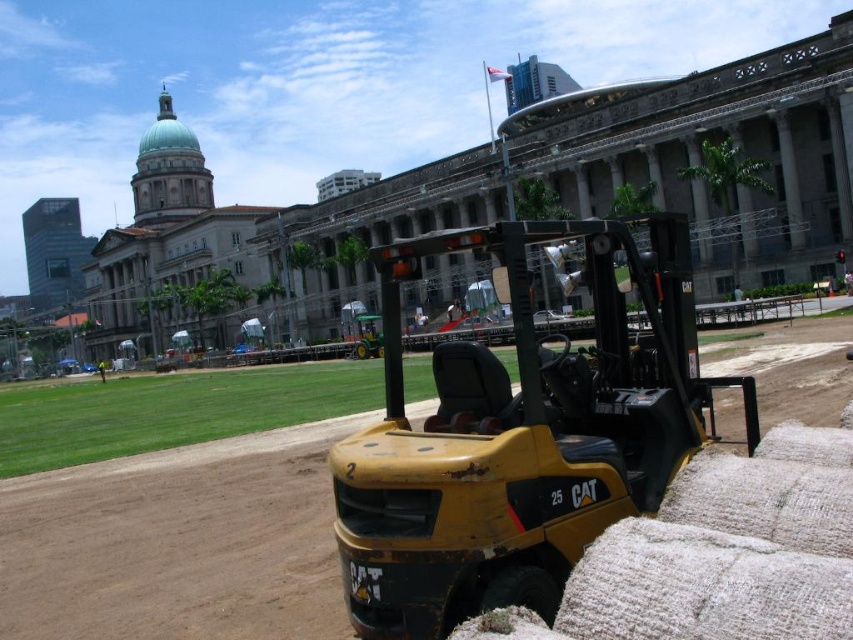
Is yellow metallic excavator at center shorter than brown dirt track at center?

In fact, yellow metallic excavator at center may be taller than brown dirt track at center.

Where is `yellow metallic excavator at center`? The width and height of the screenshot is (853, 640). yellow metallic excavator at center is located at coordinates (520, 435).

What are the coordinates of `yellow metallic excavator at center` in the screenshot? It's located at (520, 435).